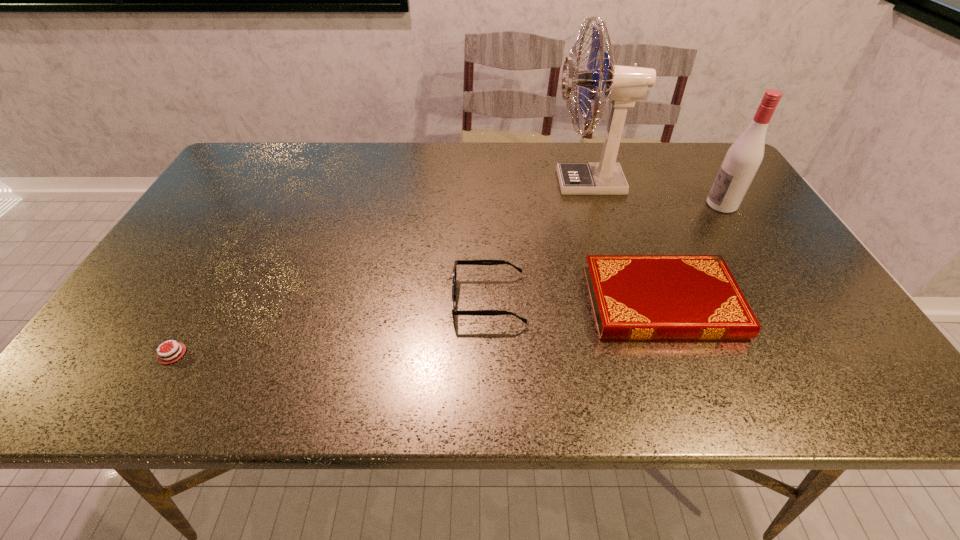
Image resolution: width=960 pixels, height=540 pixels. I want to click on vacant space located on the front-facing side of the fan, so click(x=466, y=183).

Where is `vacant region located on the label of the alcohol`? vacant region located on the label of the alcohol is located at coordinates (588, 205).

Locate an element on the screen. vacant space located 0.390m on the label of the alcohol is located at coordinates (570, 205).

Image resolution: width=960 pixels, height=540 pixels. In order to click on free space located on the label of the alcohol in this screenshot , I will do `click(566, 205)`.

This screenshot has height=540, width=960. Find the location of `blank space located at the front lenses of the fourth object from right to left`. blank space located at the front lenses of the fourth object from right to left is located at coordinates (282, 300).

Find the location of a particular element. Image resolution: width=960 pixels, height=540 pixels. vacant space situated at the front lenses of the fourth object from right to left is located at coordinates [322, 300].

Identify the location of blank space located 0.170m at the front lenses of the fourth object from right to left. (378, 300).

You are a GUI agent. You are given a task and a screenshot of the screen. Output one action in this format:
    pyautogui.click(x=<x>, y=<y>)
    Task: Click on the vacant area situated 0.310m on the cover of the fourth tallest object
    The image size is (960, 540).
    Given the screenshot: What is the action you would take?
    pyautogui.click(x=454, y=302)

Locate an element on the screen. The width and height of the screenshot is (960, 540). free space located on the cover of the fourth tallest object is located at coordinates (481, 302).

This screenshot has width=960, height=540. I want to click on vacant position located 0.310m on the cover of the fourth tallest object, so click(454, 302).